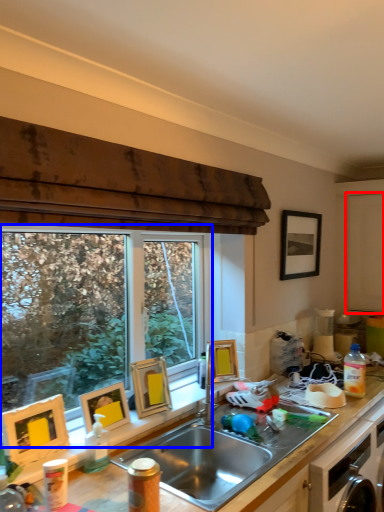
Question: Which point is closer to the camera, screen door (highlighted by a red box) or window (highlighted by a blue box)?

Choices:
 (A) screen door
 (B) window

Answer: (B)